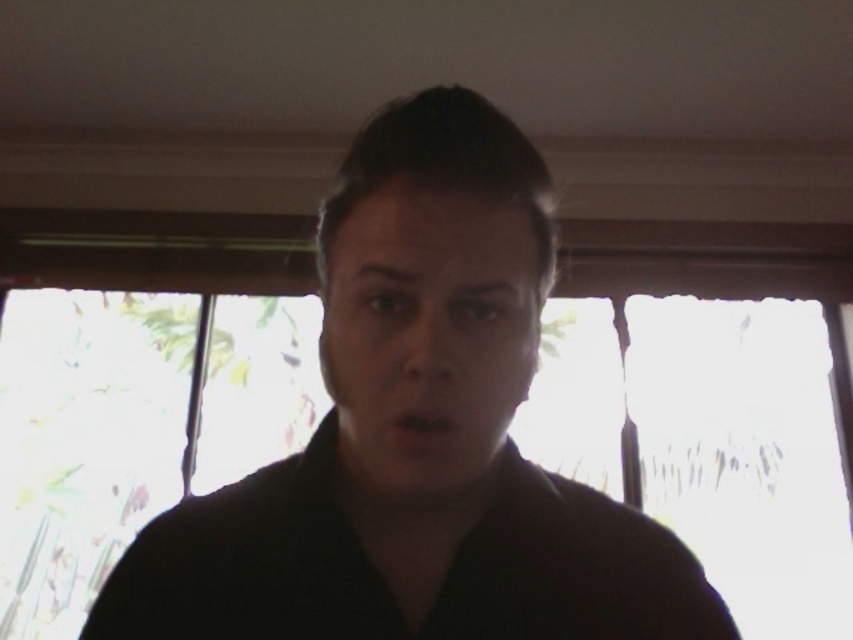
Question: Is the position of black matte robe at center less distant than that of matte black face at center?

Choices:
 (A) yes
 (B) no

Answer: (B)

Question: Does black matte shirt at center appear under black matte robe at center?

Choices:
 (A) yes
 (B) no

Answer: (B)

Question: Which of the following is the farthest from the observer?

Choices:
 (A) matte black face at center
 (B) black matte shirt at center

Answer: (B)

Question: Does black matte robe at center have a greater width compared to matte black face at center?

Choices:
 (A) no
 (B) yes

Answer: (B)

Question: Which object is positioned closest to the black matte shirt at center?

Choices:
 (A) black matte robe at center
 (B) matte black face at center

Answer: (B)

Question: Which is farther from the black matte robe at center?

Choices:
 (A) black matte shirt at center
 (B) matte black face at center

Answer: (B)